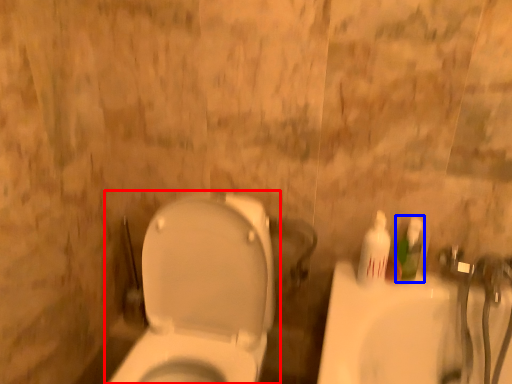
Question: Which point is closer to the camera, toilet (highlighted by a red box) or mouthwash (highlighted by a blue box)?

Choices:
 (A) toilet
 (B) mouthwash

Answer: (A)